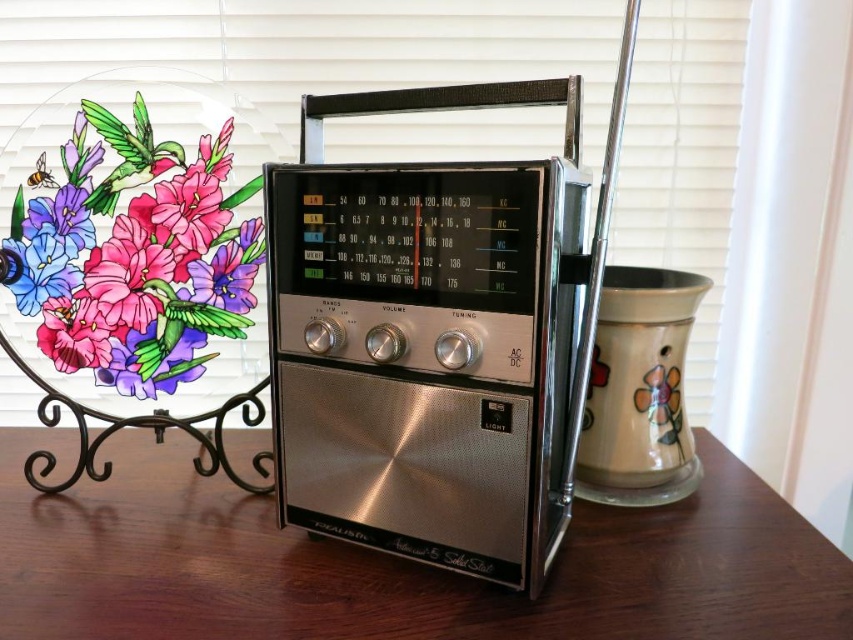
Question: Which object appears farthest from the camera in this image?

Choices:
 (A) satin wood table at center
 (B) matte glass plate with floral design at left
 (C) silver metallic radio at center

Answer: (B)

Question: Which object is positioned closest to the silver metallic radio at center?

Choices:
 (A) matte glass plate with floral design at left
 (B) satin wood table at center

Answer: (B)

Question: Does silver metallic radio at center have a greater width compared to satin wood table at center?

Choices:
 (A) yes
 (B) no

Answer: (B)

Question: Which is farther from the silver metallic radio at center?

Choices:
 (A) matte glass plate with floral design at left
 (B) satin wood table at center

Answer: (A)

Question: Can you confirm if satin wood table at center is smaller than matte glass plate with floral design at left?

Choices:
 (A) no
 (B) yes

Answer: (A)

Question: Considering the relative positions of silver metallic radio at center and matte glass plate with floral design at left in the image provided, where is silver metallic radio at center located with respect to matte glass plate with floral design at left?

Choices:
 (A) below
 (B) above

Answer: (A)